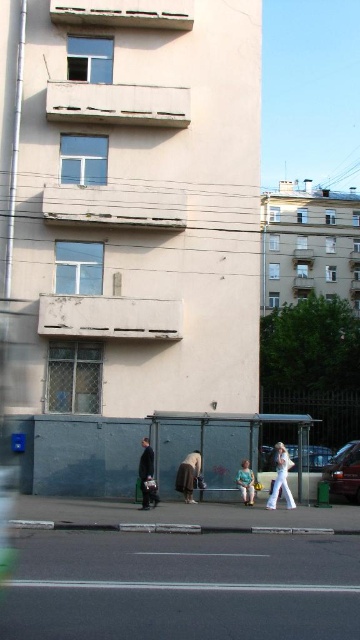
You are standing at the bus stop shelter with a green roof and dark gray body. You want to cross the street to the multi story building with a light beige facade. Is the metallic silver car at center blocking your path?

The metallic silver car at center is located at point (312, 467), which is not directly in front of the building, so it is not blocking your path to the multi story building with a light beige facade.

You are a delivery person who needs to place a package between the dark gray fabric coat at center and the light blue denim jeans at lower center. The package requires 10 feet of space. Is there enough space?

The dark gray fabric coat at center is 10.82 feet from the light blue denim jeans at lower center, so yes, there is enough space to place the package between them since the distance is greater than 10 feet.